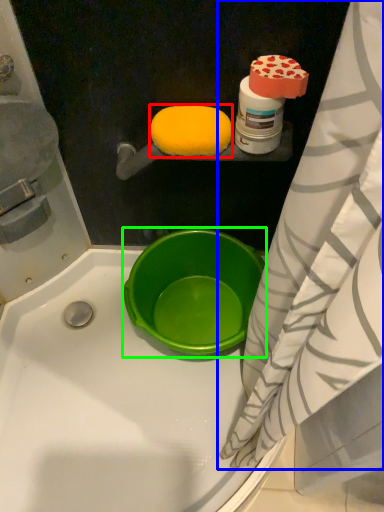
Question: Which object is the closest to the food (highlighted by a red box)? Choose among these: curtain (highlighted by a blue box) or basin (highlighted by a green box).

Choices:
 (A) curtain
 (B) basin

Answer: (A)